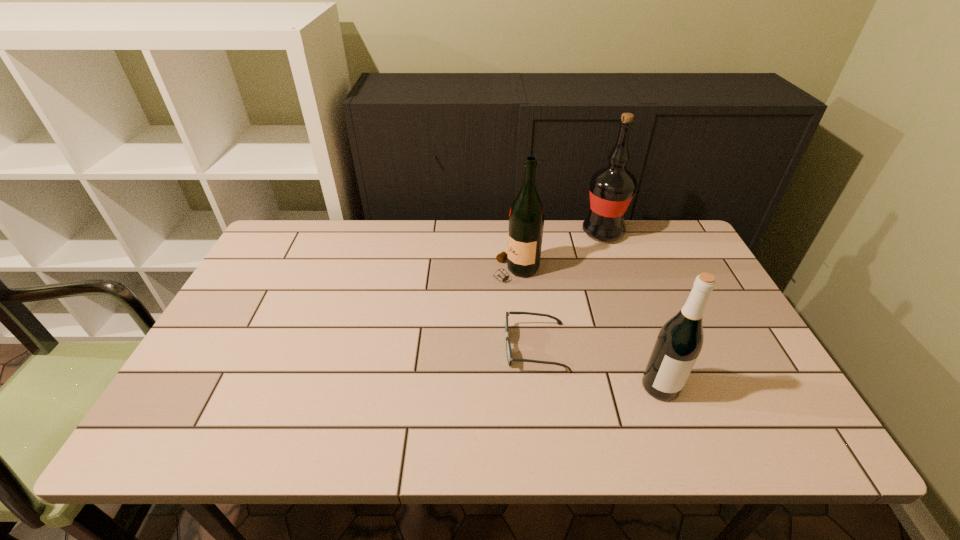
Locate an element on the screen. The width and height of the screenshot is (960, 540). free point between the farthest object and the nearest wine bottle is located at coordinates (632, 309).

You are a GUI agent. You are given a task and a screenshot of the screen. Output one action in this format:
    pyautogui.click(x=<x>, y=<y>)
    Task: Click on the vacant area that lies between the shortest object and the leftmost wine bottle
    Image resolution: width=960 pixels, height=540 pixels.
    Given the screenshot: What is the action you would take?
    pyautogui.click(x=525, y=308)

Find the location of a particular element. vacant space in between the shortest object and the nearest wine bottle is located at coordinates (598, 367).

Image resolution: width=960 pixels, height=540 pixels. Find the location of `vacant area that lies between the shortest object and the second farthest object`. vacant area that lies between the shortest object and the second farthest object is located at coordinates (525, 308).

At what (x,y) coordinates should I click in order to perform the action: click on vacant area that lies between the farthest object and the nearest wine bottle. Please return your answer as a coordinate pair (x, y). Image resolution: width=960 pixels, height=540 pixels. Looking at the image, I should click on (632, 309).

The height and width of the screenshot is (540, 960). Identify the location of empty location between the nearest wine bottle and the leftmost wine bottle. (588, 328).

Identify the location of unoccupied area between the nearest wine bottle and the spectacles. This screenshot has height=540, width=960. (598, 367).

This screenshot has width=960, height=540. Find the location of `vacant space that's between the shortest object and the nearest wine bottle`. vacant space that's between the shortest object and the nearest wine bottle is located at coordinates (598, 367).

Point out which object is positioned as the nearest to the farthest wine bottle. Please provide its 2D coordinates. Your answer should be formatted as a tuple, i.e. [(x, y)], where the tuple contains the x and y coordinates of a point satisfying the conditions above.

[(526, 218)]

Locate an element on the screen. The width and height of the screenshot is (960, 540). object that can be found as the second closest to the leftmost wine bottle is located at coordinates (611, 188).